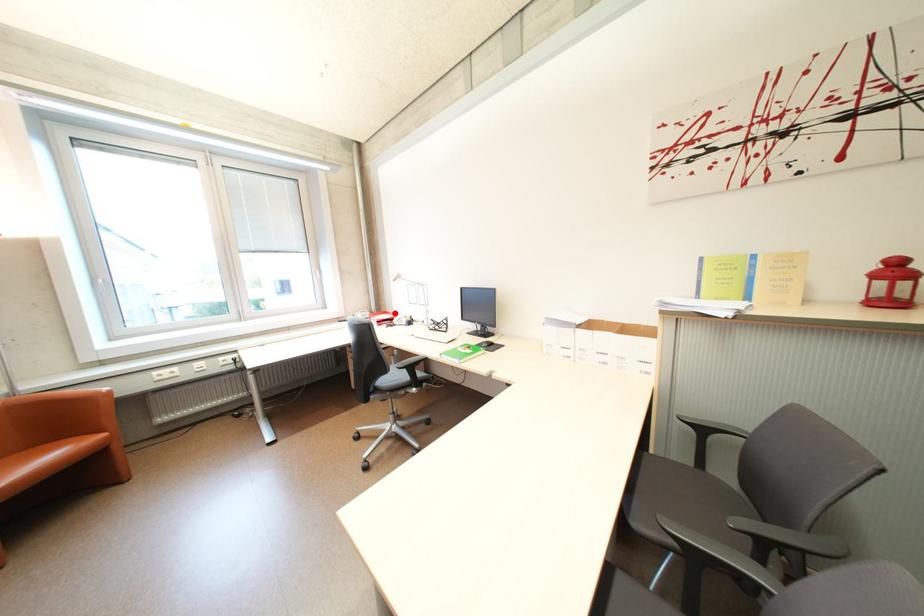
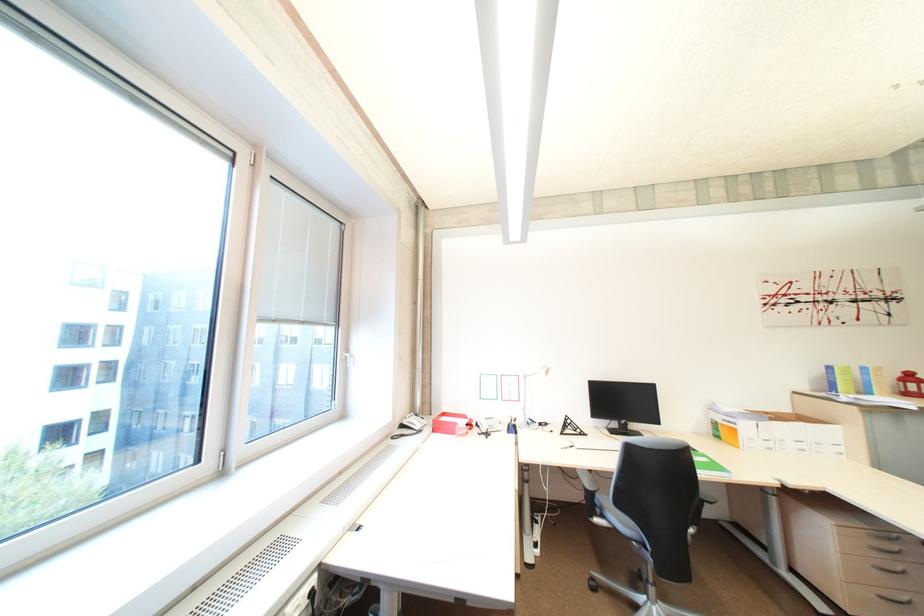
Question: I am providing you with two images of the same scene from different viewpoints. Image1 has a red point marked. In image2, the corresponding 3D location appears at what relative position? Reply with the corresponding letter.

Choices:
 (A) Closer
 (B) Farther

Answer: (B)